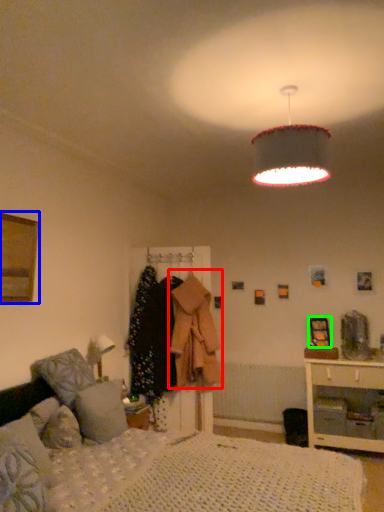
Question: Based on their relative distances, which object is farther from clothing (highlighted by a red box)? Choose from picture frame (highlighted by a blue box) and picture frame (highlighted by a green box).

Choices:
 (A) picture frame
 (B) picture frame

Answer: (A)